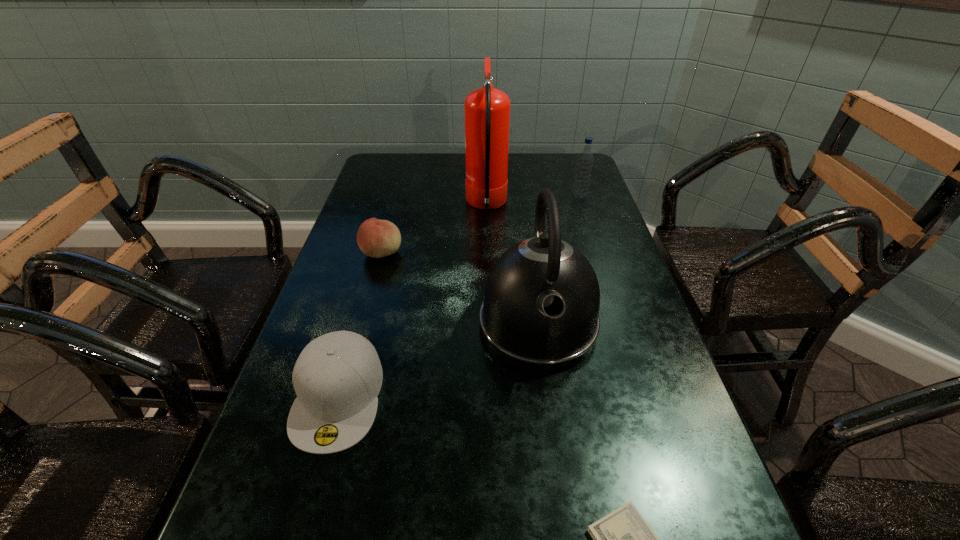
Where is `vacant area located on the front-facing side of the cap`? This screenshot has width=960, height=540. vacant area located on the front-facing side of the cap is located at coordinates (313, 485).

Locate an element on the screen. The width and height of the screenshot is (960, 540). free space located on the front of the fourth nearest object is located at coordinates (373, 284).

Find the location of a particular element. This screenshot has height=540, width=960. cap present at the left edge is located at coordinates (337, 377).

I want to click on peach at the left edge, so click(376, 238).

I want to click on kettle that is positioned at the right edge, so click(x=540, y=311).

The width and height of the screenshot is (960, 540). I want to click on water bottle located at the right edge, so click(x=585, y=160).

I want to click on free spot at the far edge of the desktop, so click(x=423, y=177).

In the image, there is a desktop. Find the location of `vacant space at the left edge`. vacant space at the left edge is located at coordinates (336, 514).

Where is `free location at the right edge of the desktop`? The width and height of the screenshot is (960, 540). free location at the right edge of the desktop is located at coordinates (631, 450).

In the image, there is a desktop. Identify the location of vacant space at the far left corner. This screenshot has width=960, height=540. (387, 180).